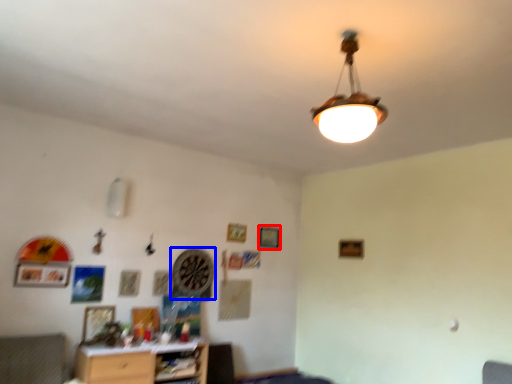
Question: Among these objects, which one is farthest to the camera, picture frame (highlighted by a red box) or clock (highlighted by a blue box)?

Choices:
 (A) picture frame
 (B) clock

Answer: (A)